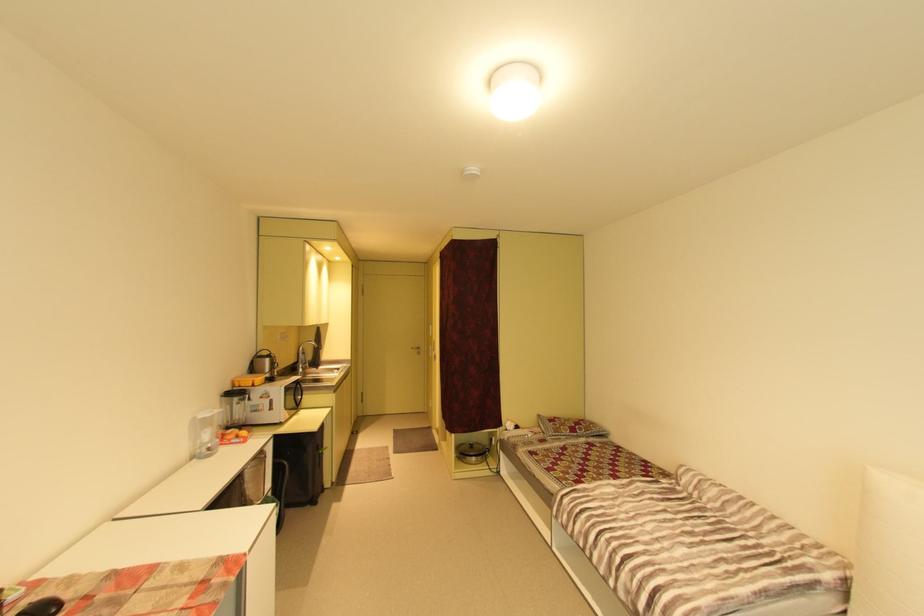
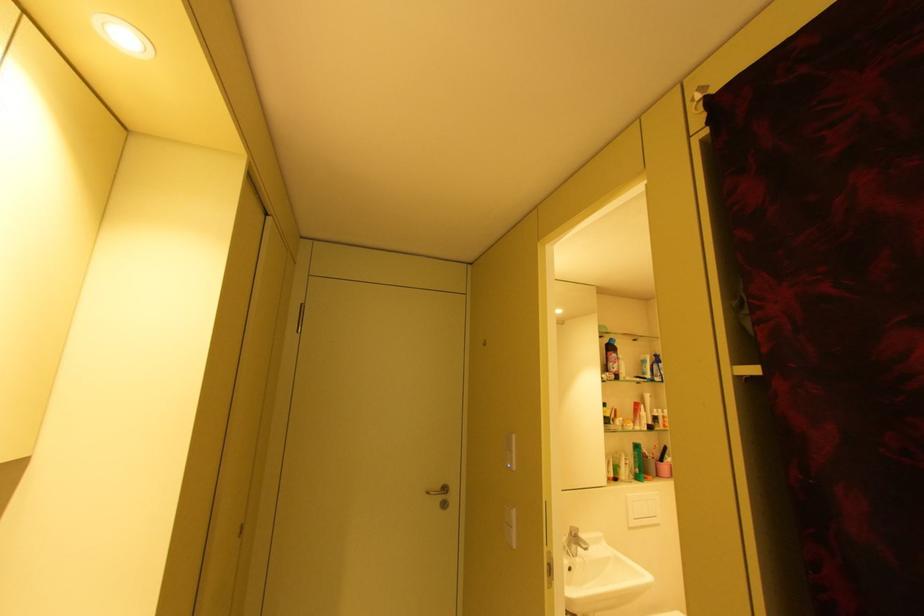
Question: The images are taken continuously from a first-person perspective. In which direction are you moving?

Choices:
 (A) Left
 (B) Right
 (C) Forward
 (D) Backward

Answer: (C)